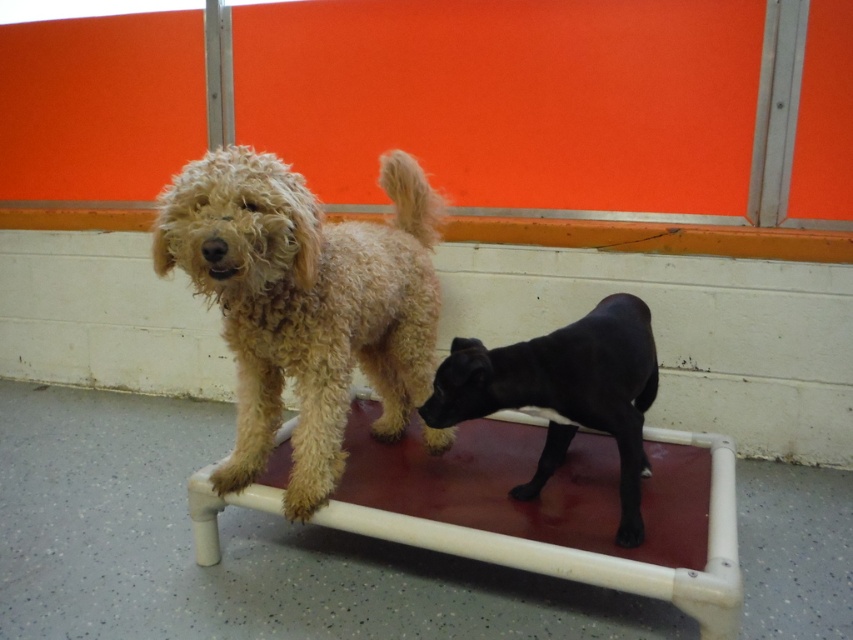
Find the location of `curly beige dog at center`. curly beige dog at center is located at coordinates (305, 304).

Between curly beige dog at center and black smooth dog at center, which one has more height?

curly beige dog at center is taller.

Between point (305, 502) and point (585, 346), which one is positioned in front?

Point (585, 346)

Find the location of a particular element. curly beige dog at center is located at coordinates (305, 304).